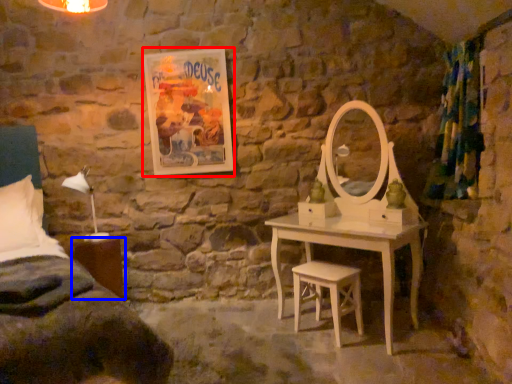
Question: Which of the following is the closest to the observer, picture frame (highlighted by a red box) or nightstand (highlighted by a blue box)?

Choices:
 (A) picture frame
 (B) nightstand

Answer: (B)